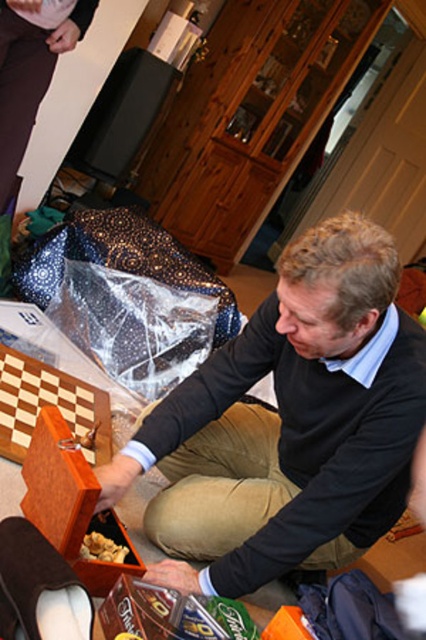
You are a delivery person standing at the entrance of the room. You need to place a small package on the matte black sweater at center without disturbing the man. Can you reach it from your current position?

The distance between the matte black sweater at center and the viewer is 1.07 meters. Since you are a delivery person standing at the entrance, you can likely extend your arm or take a few steps forward to place the package on the matte black sweater at center without needing to get too close to the man.

Consider the image. You are standing in the room and see two points marked in the image. Which point is closer to you, point (103, 451) or point (106, 545)?

Point (103, 451) is closer to you because it is further to the viewer than point (106, 545).